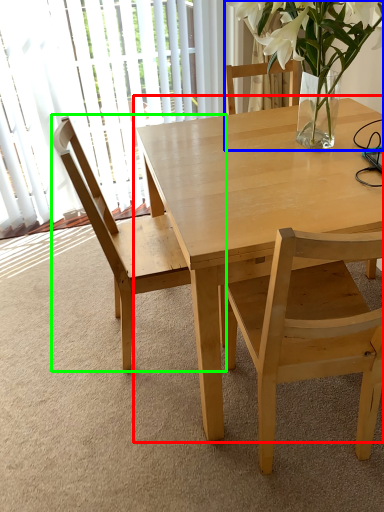
Question: Considering the real-world distances, which object is closest to kitchen & dining room table (highlighted by a red box)? houseplant (highlighted by a blue box) or chair (highlighted by a green box).

Choices:
 (A) houseplant
 (B) chair

Answer: (A)